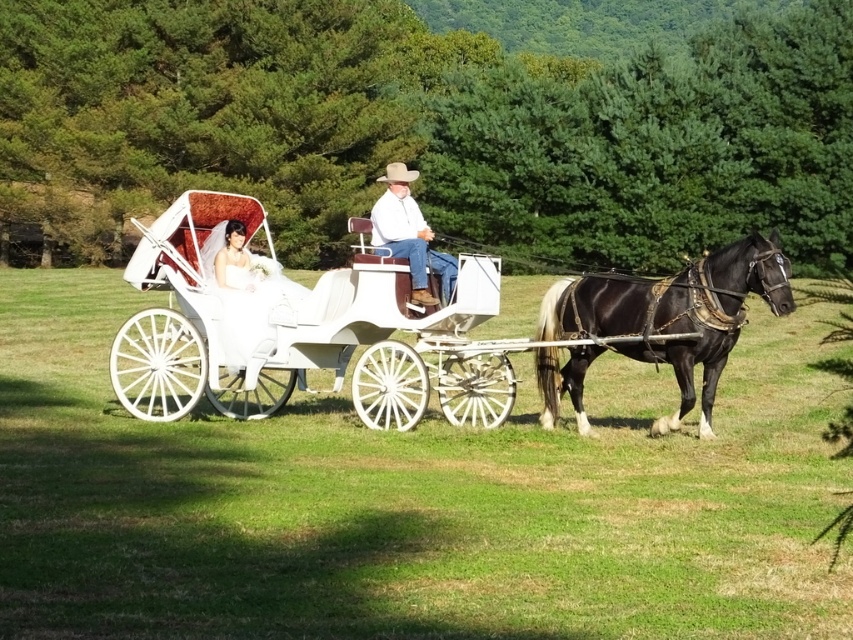
Question: Among these points, which one is nearest to the camera?

Choices:
 (A) (393, 244)
 (B) (361, 317)

Answer: (B)

Question: Is white polished wood cart at center to the right of black glossy horse at right from the viewer's perspective?

Choices:
 (A) yes
 (B) no

Answer: (B)

Question: Can you confirm if white polished wood cart at center is positioned to the right of black glossy horse at right?

Choices:
 (A) yes
 (B) no

Answer: (B)

Question: Among these points, which one is farthest from the camera?

Choices:
 (A) (418, 257)
 (B) (618, 300)

Answer: (B)

Question: Is white polished wood cart at center above black glossy horse at right?

Choices:
 (A) yes
 (B) no

Answer: (B)

Question: Which point is closer to the camera?

Choices:
 (A) (215, 321)
 (B) (424, 304)

Answer: (B)